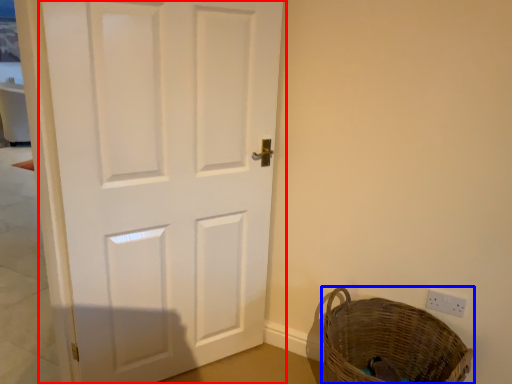
Question: Which object is further to the camera taking this photo, door (highlighted by a red box) or basket (highlighted by a blue box)?

Choices:
 (A) door
 (B) basket

Answer: (B)